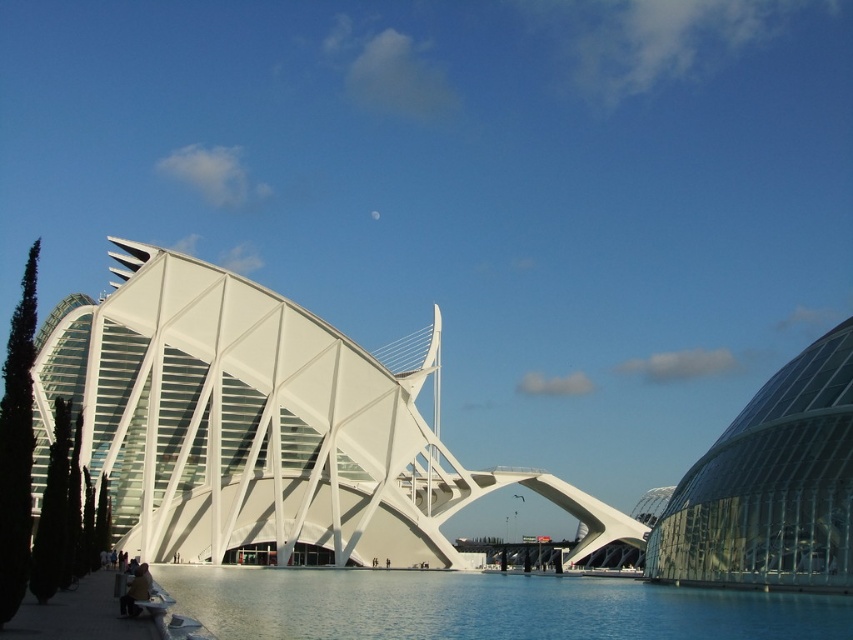
Question: Estimate the real-world distances between objects in this image. Which object is closer to the transparent blue water at center?

Choices:
 (A) white glass bridge at center
 (B) transparent glass dome at right

Answer: (B)

Question: From the image, what is the correct spatial relationship of white glass bridge at center in relation to transparent glass dome at right?

Choices:
 (A) above
 (B) below

Answer: (A)

Question: Which point is farther to the camera?

Choices:
 (A) (215, 576)
 (B) (825, 381)
 (C) (430, 449)

Answer: (C)

Question: Which object is the closest to the transparent blue water at center?

Choices:
 (A) transparent glass dome at right
 (B) white glass bridge at center

Answer: (A)

Question: Does transparent blue water at center appear on the right side of transparent glass dome at right?

Choices:
 (A) no
 (B) yes

Answer: (A)

Question: Is transparent blue water at center to the right of transparent glass dome at right from the viewer's perspective?

Choices:
 (A) no
 (B) yes

Answer: (A)